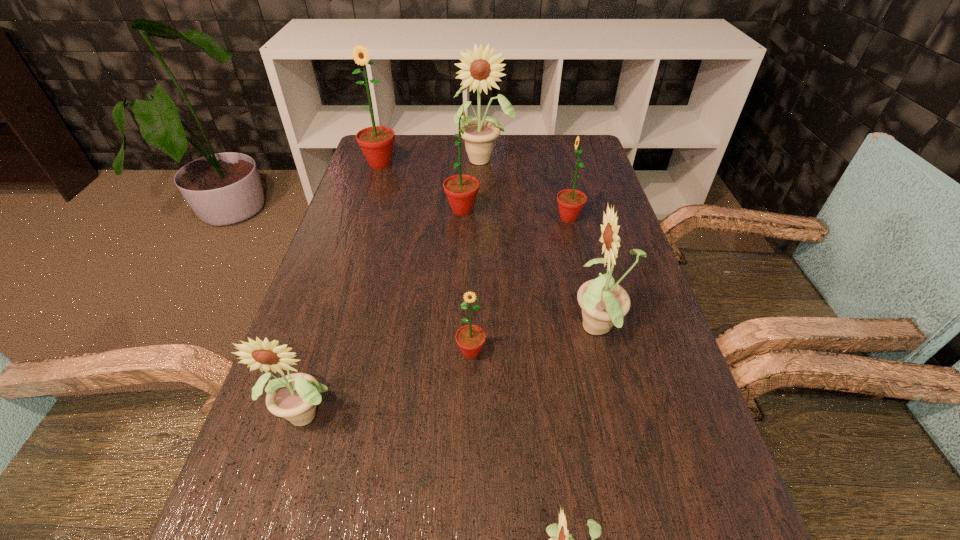
Locate an element on the screen. the fourth closest yellow sunflower to the second smallest green sunflower is located at coordinates (562, 539).

Locate an element on the screen. yellow sunflower that is the third nearest to the rightmost yellow sunflower is located at coordinates (479, 136).

Image resolution: width=960 pixels, height=540 pixels. Identify the location of green sunflower that is the fourth nearest to the farthest yellow sunflower. (470, 338).

Image resolution: width=960 pixels, height=540 pixels. In order to click on the third closest green sunflower to the second biggest green sunflower in this screenshot , I will do `click(470, 338)`.